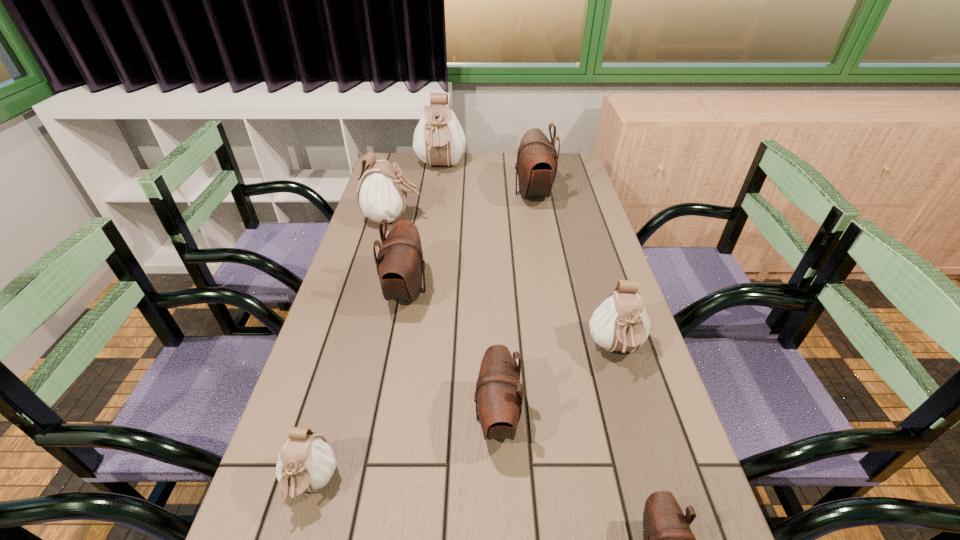
Locate which object is the seventh closest to the biggest brown pouch. Please provide its 2D coordinates. Your answer should be formatted as a tuple, i.e. [(x, y)], where the tuple contains the x and y coordinates of a point satisfying the conditions above.

[(667, 537)]

Choose which object is the fifth nearest neighbor to the smallest brown pouch. Please provide its 2D coordinates. Your answer should be formatted as a tuple, i.e. [(x, y)], where the tuple contains the x and y coordinates of a point satisfying the conditions above.

[(537, 160)]

Identify which pouch is the fifth nearest to the smallest white pouch. Please provide its 2D coordinates. Your answer should be formatted as a tuple, i.e. [(x, y)], where the tuple contains the x and y coordinates of a point satisfying the conditions above.

[(382, 193)]

I want to click on pouch that stands as the fifth closest to the fifth farthest object, so click(x=306, y=462).

Identify which white pouch is located as the second nearest to the nearest brown pouch. Please provide its 2D coordinates. Your answer should be formatted as a tuple, i.e. [(x, y)], where the tuple contains the x and y coordinates of a point satisfying the conditions above.

[(306, 462)]

Choose which white pouch is the second nearest neighbor to the smallest white pouch. Please provide its 2D coordinates. Your answer should be formatted as a tuple, i.e. [(x, y)], where the tuple contains the x and y coordinates of a point satisfying the conditions above.

[(382, 193)]

You are a GUI agent. You are given a task and a screenshot of the screen. Output one action in this format:
    pyautogui.click(x=<x>, y=<y>)
    Task: Click on the closest brown pouch to the second nearest brown pouch
    
    Given the screenshot: What is the action you would take?
    pyautogui.click(x=667, y=537)

Find the location of `brown pouch object that ranks as the fourth closest to the biggest white pouch`. brown pouch object that ranks as the fourth closest to the biggest white pouch is located at coordinates click(667, 537).

This screenshot has height=540, width=960. I want to click on free point that satisfies the following two spatial constraints: 1. on the front-facing side of the second biggest white pouch; 2. on the front-facing side of the smallest white pouch, so click(323, 484).

Find the location of a particular element. free space that satisfies the following two spatial constraints: 1. with the flap open on the fifth nearest object; 2. on the front-facing side of the nearest white pouch is located at coordinates (371, 484).